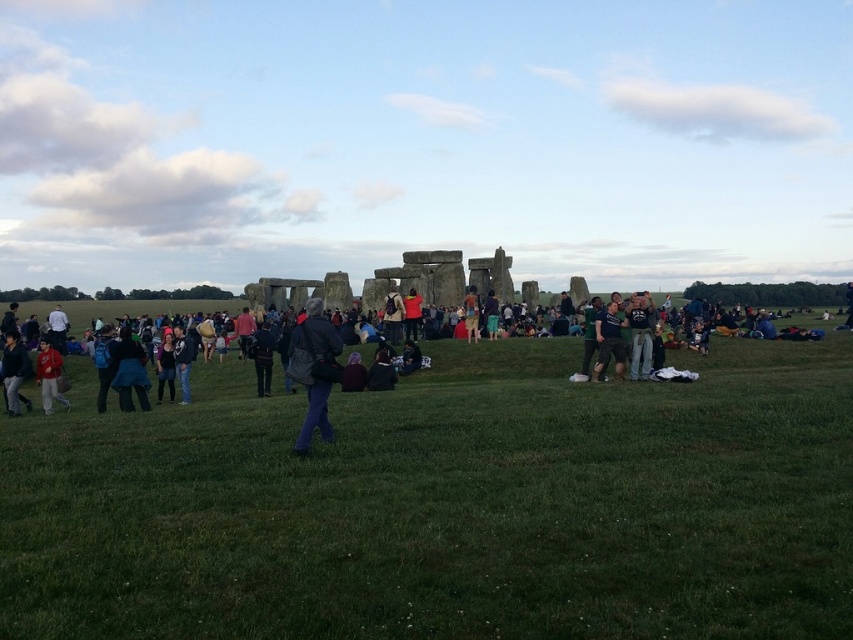
Is dark blue jacket at lower left bigger than matte red jacket at center?

Correct, dark blue jacket at lower left is larger in size than matte red jacket at center.

How much distance is there between dark blue jacket at lower left and matte red jacket at center?

They are 39.09 meters apart.

Locate an element on the screen. dark blue jacket at lower left is located at coordinates (129, 371).

Is dark blue jeans at center shorter than dark blue backpack at lower left?

No, dark blue jeans at center is not shorter than dark blue backpack at lower left.

Is dark blue jeans at center further to the viewer compared to dark blue backpack at lower left?

That is True.

Locate an element on the screen. The width and height of the screenshot is (853, 640). dark blue jeans at center is located at coordinates (640, 336).

Between dark blue shirt at center and matte black jacket at center, which one is positioned lower?

dark blue shirt at center is below.

Measure the distance between dark blue shirt at center and matte black jacket at center.

dark blue shirt at center is 106.18 feet from matte black jacket at center.

Between point (595, 372) and point (402, 310), which one is positioned in front?

Point (595, 372) is more forward.

Identify the location of dark blue shirt at center. (608, 340).